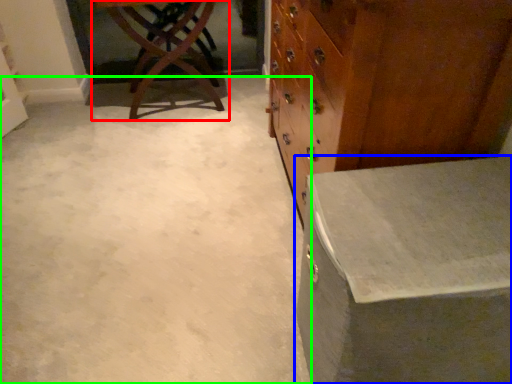
Question: Which object is positioned farthest from table (highlighted by a red box)? Select from table (highlighted by a blue box) and concrete (highlighted by a green box).

Choices:
 (A) table
 (B) concrete

Answer: (A)